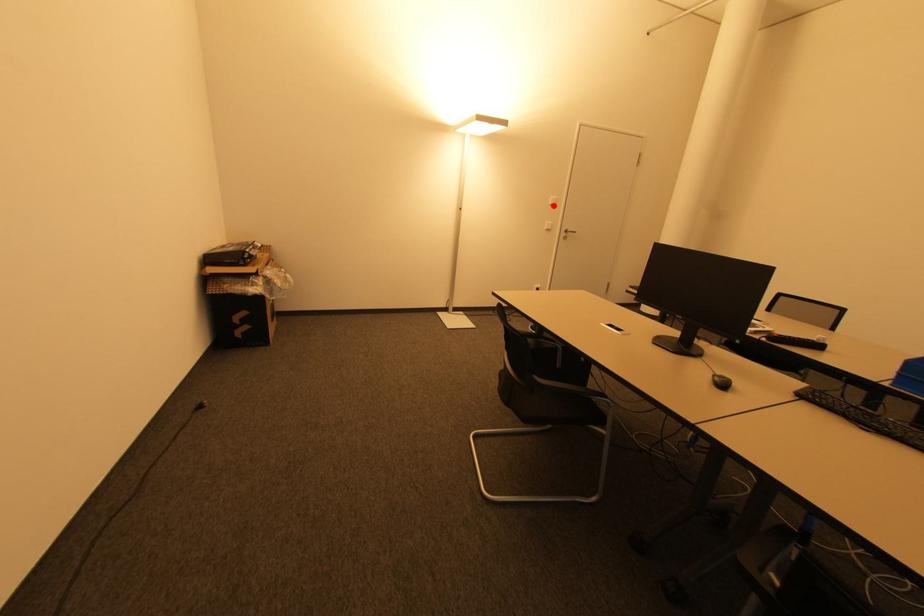
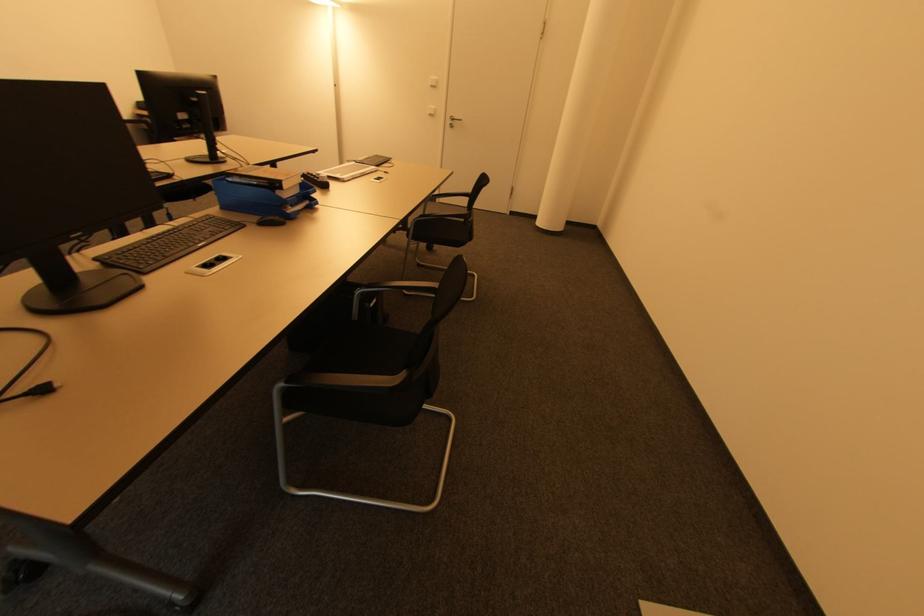
Where in the second image is the point corresponding to the highlighted location from the first image?

(434, 87)